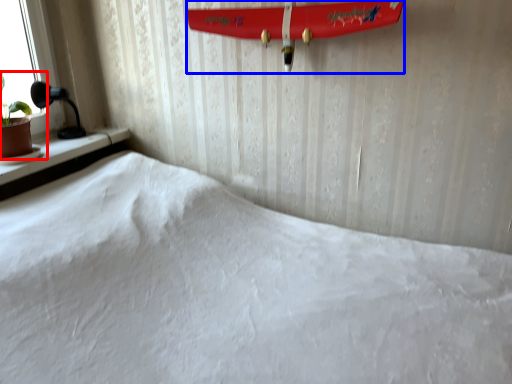
Question: Which point is closer to the camera, houseplant (highlighted by a red box) or surfboard (highlighted by a blue box)?

Choices:
 (A) houseplant
 (B) surfboard

Answer: (B)